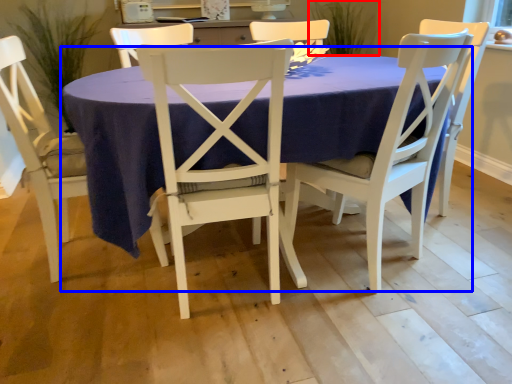
Question: Among these objects, which one is farthest to the camera, plant (highlighted by a red box) or kitchen & dining room table (highlighted by a blue box)?

Choices:
 (A) plant
 (B) kitchen & dining room table

Answer: (A)